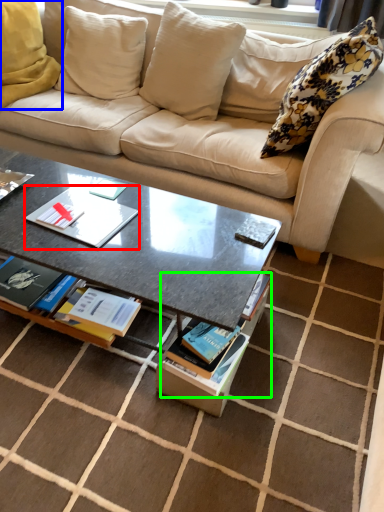
Question: Estimate the real-world distances between objects in this image. Which object is farther from paperback book (highlighted by a red box), pillow (highlighted by a blue box) or magazine (highlighted by a green box)?

Choices:
 (A) pillow
 (B) magazine

Answer: (A)